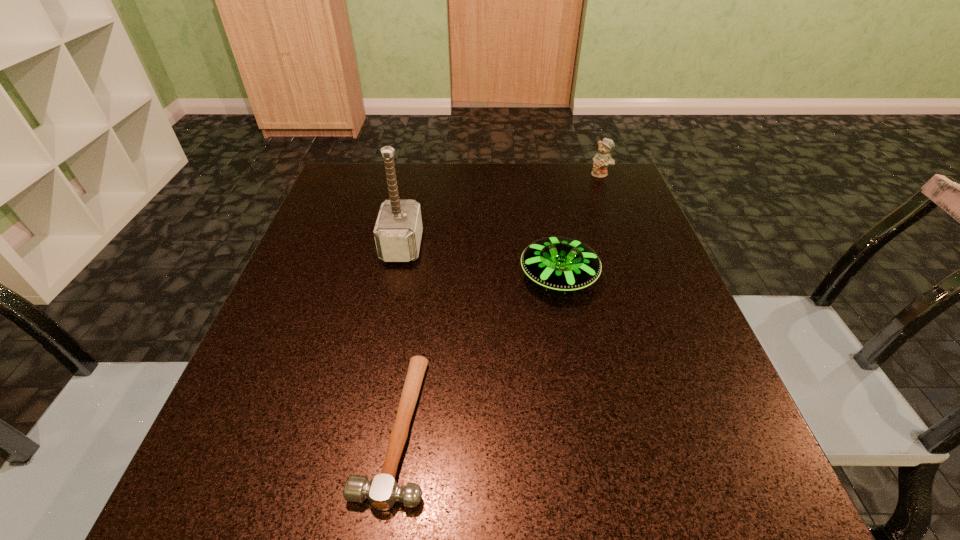
Where is `free region located on the left of the second shortest object`? free region located on the left of the second shortest object is located at coordinates (386, 277).

I want to click on free space located 0.190m on the left of the nearest object, so (x=233, y=427).

Where is `object that is at the far edge`? This screenshot has height=540, width=960. object that is at the far edge is located at coordinates (601, 160).

Locate an element on the screen. This screenshot has height=540, width=960. object that is at the near edge is located at coordinates (382, 491).

Where is `teddy bear positioned at the right edge`? Image resolution: width=960 pixels, height=540 pixels. teddy bear positioned at the right edge is located at coordinates (601, 160).

At what (x,y) coordinates should I click in order to perform the action: click on saucer that is at the right edge. Please return your answer as a coordinate pair (x, y). Looking at the image, I should click on (559, 263).

The width and height of the screenshot is (960, 540). What are the coordinates of `object located at the far right corner` in the screenshot? It's located at (601, 160).

You are a GUI agent. You are given a task and a screenshot of the screen. Output one action in this format:
    pyautogui.click(x=<x>, y=<y>)
    Task: Click on the free space at the far edge of the desktop
    This screenshot has width=960, height=540.
    Given the screenshot: What is the action you would take?
    pyautogui.click(x=487, y=166)

The image size is (960, 540). In the image, there is a desktop. In order to click on free region at the near edge in this screenshot , I will do `click(367, 459)`.

This screenshot has height=540, width=960. In the image, there is a desktop. What are the coordinates of `vacant region at the left edge` in the screenshot? It's located at (280, 382).